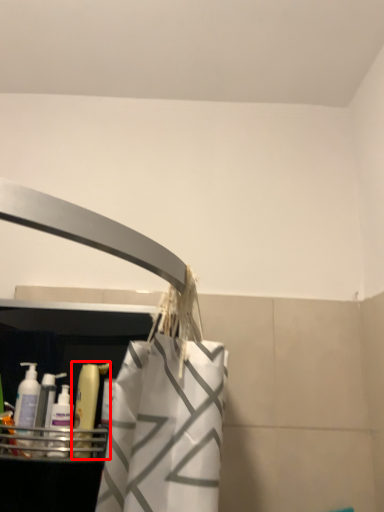
Question: From the image, what is the correct spatial relationship of cleaning product (annotated by the red box) in relation to cleaning product?

Choices:
 (A) left
 (B) right

Answer: (B)